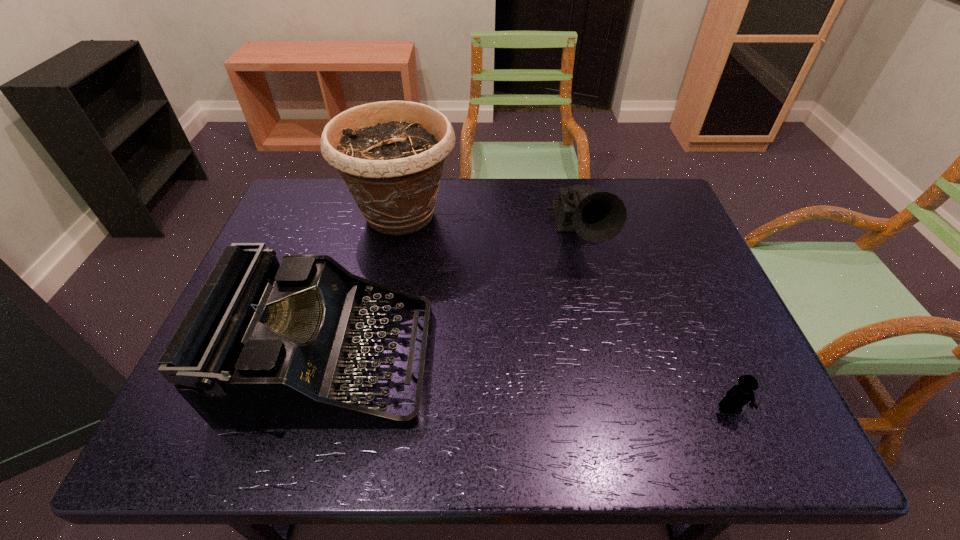
Find the location of a particular element. The width and height of the screenshot is (960, 540). phonograph_record that is at the far edge is located at coordinates (597, 216).

Identify the location of typewriter that is at the near edge. The width and height of the screenshot is (960, 540). (263, 346).

Locate an element on the screen. Image resolution: width=960 pixels, height=540 pixels. Lego situated at the near edge is located at coordinates (739, 395).

I want to click on object that is at the left edge, so click(263, 346).

Identify the location of object present at the right edge. The width and height of the screenshot is (960, 540). (739, 395).

The width and height of the screenshot is (960, 540). Find the location of `object situated at the near left corner`. object situated at the near left corner is located at coordinates (263, 346).

Locate an element on the screen. This screenshot has width=960, height=540. object that is positioned at the near right corner is located at coordinates (739, 395).

Where is `vacant space at the far edge of the desktop`? vacant space at the far edge of the desktop is located at coordinates [x=524, y=202].

Locate an element on the screen. The height and width of the screenshot is (540, 960). vacant region at the near edge of the desktop is located at coordinates (479, 441).

This screenshot has width=960, height=540. In order to click on free location at the left edge of the desktop in this screenshot , I will do `click(313, 249)`.